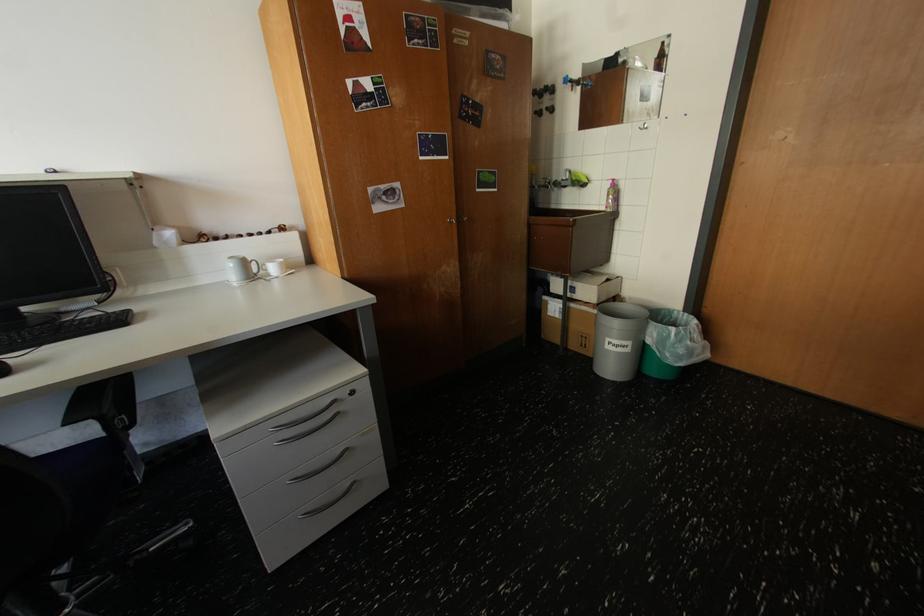
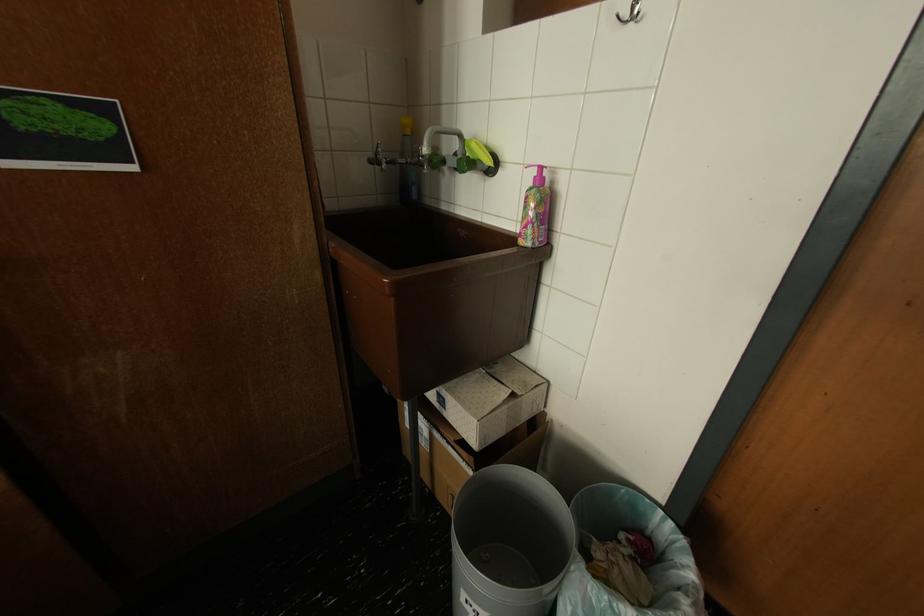
Find the pixel in the second image that matches the point at 619,183 in the first image.

(542, 172)